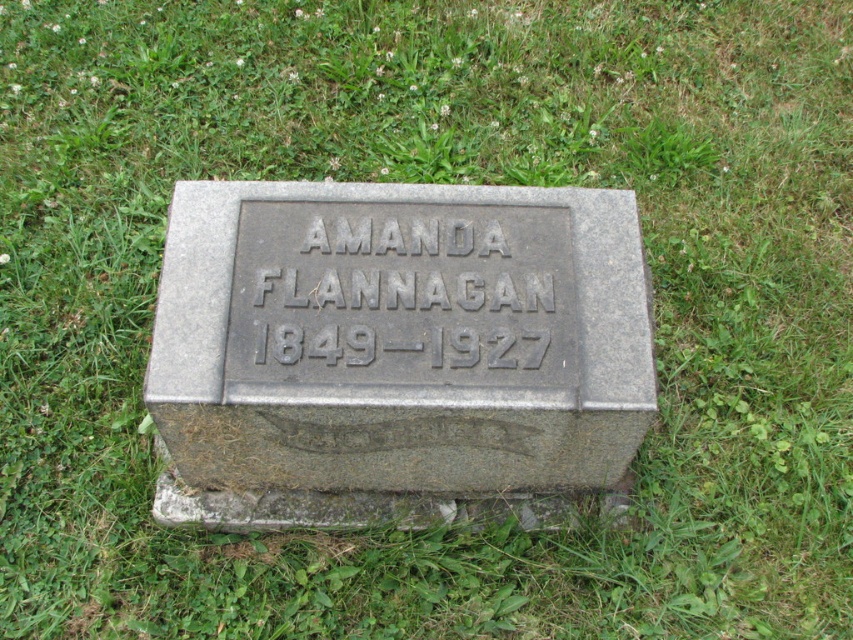
Is gray stone gravestone at center further to camera compared to black engraved stone at center?

That is False.

Can you confirm if gray stone gravestone at center is taller than black engraved stone at center?

Correct, gray stone gravestone at center is much taller as black engraved stone at center.

Where is `gray stone gravestone at center`? gray stone gravestone at center is located at coordinates (395, 349).